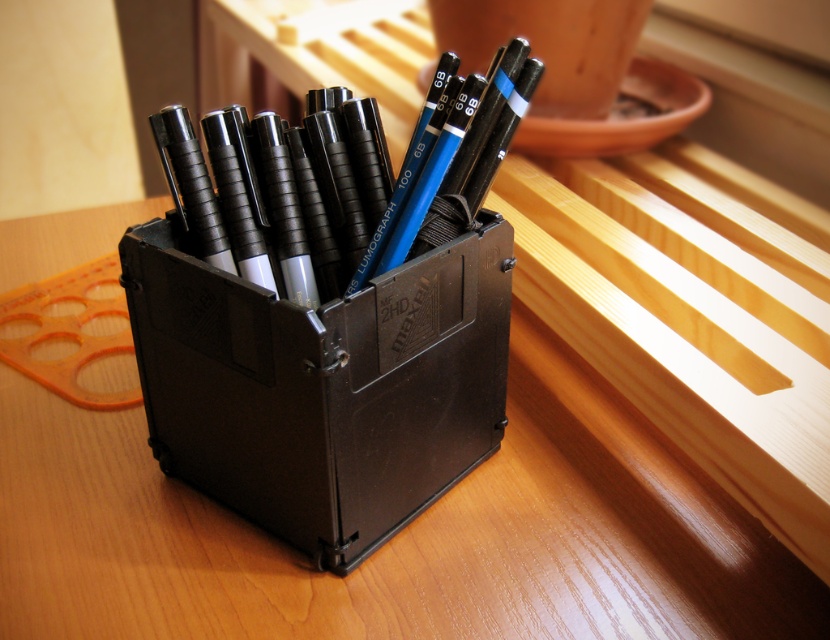
Question: Which object is closer to the camera taking this photo?

Choices:
 (A) black plastic box at center
 (B) wooden table at center

Answer: (A)

Question: Can you confirm if wooden table at center is positioned above black plastic box at center?

Choices:
 (A) no
 (B) yes

Answer: (A)

Question: Is wooden table at center thinner than black plastic box at center?

Choices:
 (A) no
 (B) yes

Answer: (A)

Question: Can you confirm if wooden table at center is positioned to the right of black plastic box at center?

Choices:
 (A) no
 (B) yes

Answer: (B)

Question: Among these points, which one is nearest to the camera?

Choices:
 (A) (648, 621)
 (B) (505, 358)

Answer: (A)